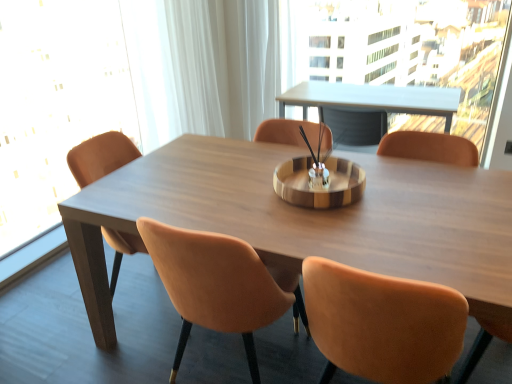
Find the location of `transparent glass window screen at left`. transparent glass window screen at left is located at coordinates (55, 103).

From a real-world perspective, who is located higher, wooden table at center or transparent glass window screen at left?

From a 3D spatial view, transparent glass window screen at left is above.

Between wooden table at center and transparent glass window screen at left, which one appears on the left side from the viewer's perspective?

transparent glass window screen at left is more to the left.

Is wooden table at center looking in the opposite direction of transparent glass window screen at left?

wooden table at center does not have its back to transparent glass window screen at left.

Identify the location of window screen lying behind the wooden table at center. This screenshot has height=384, width=512. (55, 103).

From the image's perspective, would you say transparent glass window screen at left is positioned over matte brown chair at center?

Correct, transparent glass window screen at left appears higher than matte brown chair at center in the image.

Is transparent glass window screen at left further to the viewer compared to matte brown chair at center?

Yes, the depth of transparent glass window screen at left is greater than that of matte brown chair at center.

Is transparent glass window screen at left to the left or to the right of wooden table at center in the image?

Based on their positions, transparent glass window screen at left is located to the left of wooden table at center.

Based on the photo, is transparent glass window screen at left shorter than wooden table at center?

No.

From a real-world perspective, between transparent glass window screen at left and wooden table at center, who is vertically higher?

transparent glass window screen at left is physically above.

How many degrees apart are the facing directions of wooden table at center and matte brown chair at center?

There is a 180-degree angle between the facing directions of wooden table at center and matte brown chair at center.

This screenshot has height=384, width=512. Find the location of `chair on the left of wooden table at center`. chair on the left of wooden table at center is located at coordinates pyautogui.click(x=100, y=157).

Can matte brown chair at center be found inside wooden table at center?

Yes, matte brown chair at center is a part of wooden table at center.

Can you confirm if wooden table at center is positioned to the left of matte brown chair at center?

Incorrect, wooden table at center is not on the left side of matte brown chair at center.

From the image's perspective, who appears lower, matte brown chair at center or transparent glass window screen at left?

matte brown chair at center.

Locate an element on the screen. This screenshot has width=512, height=384. window screen behind the matte brown chair at center is located at coordinates [55, 103].

Is matte brown chair at center next to transparent glass window screen at left?

matte brown chair at center and transparent glass window screen at left are clearly separated.

How much distance is there between matte brown chair at center and transparent glass window screen at left?

matte brown chair at center is 31.64 inches from transparent glass window screen at left.

Is matte brown chair at center to the right of wooden table at center from the viewer's perspective?

No.

Does matte brown chair at center have a greater width compared to wooden table at center?

Incorrect, the width of matte brown chair at center does not surpass that of wooden table at center.

Consider the image. Is matte brown chair at center positioned with its back to wooden table at center?

Yes, wooden table at center is at the back of matte brown chair at center.

Identify the location of table in front of the transparent glass window screen at left. (306, 219).

Image resolution: width=512 pixels, height=384 pixels. What are the coordinates of `chair lying below the transparent glass window screen at left (from the image's perspective)` in the screenshot? It's located at (100, 157).

Considering their positions, is matte brown chair at center positioned further to transparent glass window screen at left than wooden table at center?

wooden table at center.

Based on their spatial positions, is wooden table at center or matte brown chair at center closer to transparent glass window screen at left?

matte brown chair at center.

Looking at the image, which one is located further to matte brown chair at center, transparent glass window screen at left or wooden table at center?

wooden table at center is positioned further to the anchor matte brown chair at center.

Estimate the real-world distances between objects in this image. Which object is closer to wooden table at center, transparent glass window screen at left or matte brown chair at center?

matte brown chair at center is closer to wooden table at center.

Looking at the image, which one is located further to wooden table at center, matte brown chair at center or transparent glass window screen at left?

Answer: transparent glass window screen at left lies further to wooden table at center than the other object.

Which object lies nearer to the anchor point matte brown chair at center, wooden table at center or transparent glass window screen at left?

transparent glass window screen at left.

Where is `chair between transparent glass window screen at left and wooden table at center from left to right`? The height and width of the screenshot is (384, 512). chair between transparent glass window screen at left and wooden table at center from left to right is located at coordinates (100, 157).